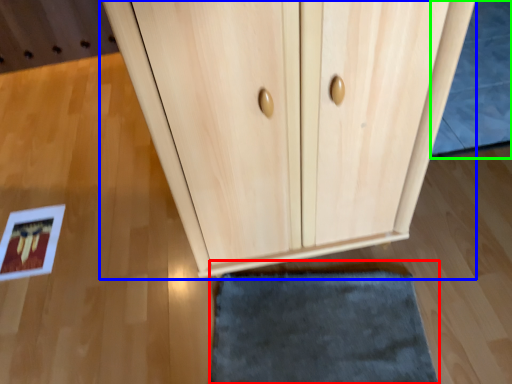
Question: Estimate the real-world distances between objects in this image. Which object is farther from door (highlighted by a red box), cupboard (highlighted by a blue box) or bath mat (highlighted by a green box)?

Choices:
 (A) cupboard
 (B) bath mat

Answer: (B)